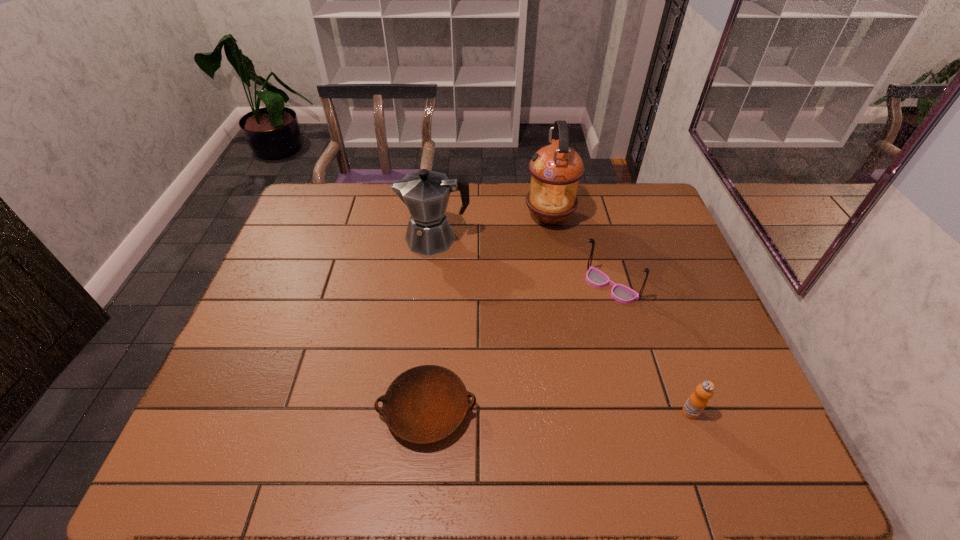
Find the location of a particular element. The width and height of the screenshot is (960, 540). the tallest object is located at coordinates (556, 169).

Image resolution: width=960 pixels, height=540 pixels. What are the coordinates of `the second tallest object` in the screenshot? It's located at (426, 193).

Where is `the third tallest object`? The width and height of the screenshot is (960, 540). the third tallest object is located at coordinates (596, 278).

The image size is (960, 540). In order to click on spectacles in this screenshot , I will do `click(596, 278)`.

Identify the location of orange juice. Image resolution: width=960 pixels, height=540 pixels. (697, 401).

Identify the location of the second shortest object. The image size is (960, 540). (697, 401).

Find the location of `plate`. plate is located at coordinates (426, 404).

Image resolution: width=960 pixels, height=540 pixels. In order to click on vacant position located on the back of the oil lamp in this screenshot , I will do `click(544, 186)`.

You are a GUI agent. You are given a task and a screenshot of the screen. Output one action in this format:
    pyautogui.click(x=<x>, y=<y>)
    Task: Click on the vacant space located at the spout of the fourth shortest object
    Image resolution: width=960 pixels, height=540 pixels.
    Given the screenshot: What is the action you would take?
    pyautogui.click(x=376, y=239)

The height and width of the screenshot is (540, 960). Identify the location of blank area located 0.100m at the spout of the fourth shortest object. (367, 239).